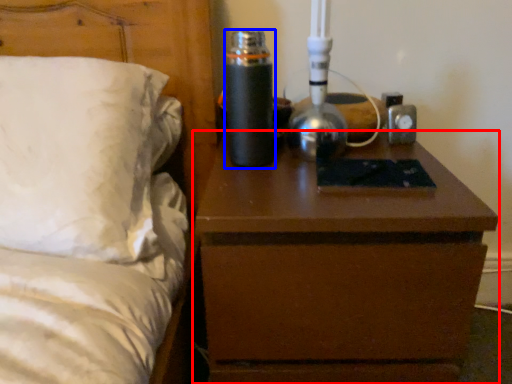
Question: Which point is further to the camera, nightstand (highlighted by a red box) or bottle (highlighted by a blue box)?

Choices:
 (A) nightstand
 (B) bottle

Answer: (B)